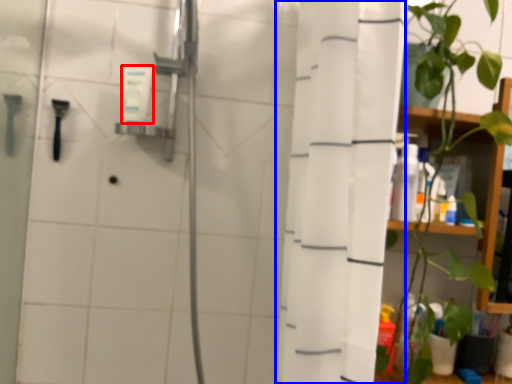
Question: Which of the following is the farthest to the observer, toiletry (highlighted by a red box) or shower curtain (highlighted by a blue box)?

Choices:
 (A) toiletry
 (B) shower curtain

Answer: (A)